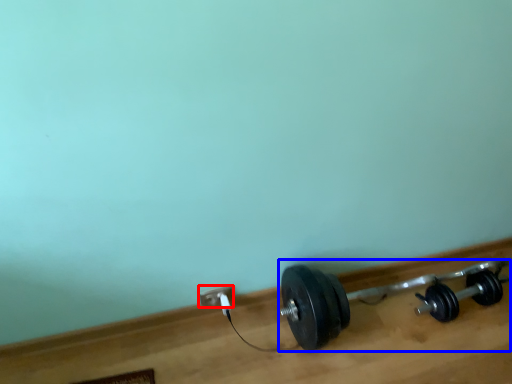
Question: Among these objects, which one is nearest to the camera, power plugs and sockets (highlighted by a red box) or dumbbell (highlighted by a blue box)?

Choices:
 (A) power plugs and sockets
 (B) dumbbell

Answer: (B)